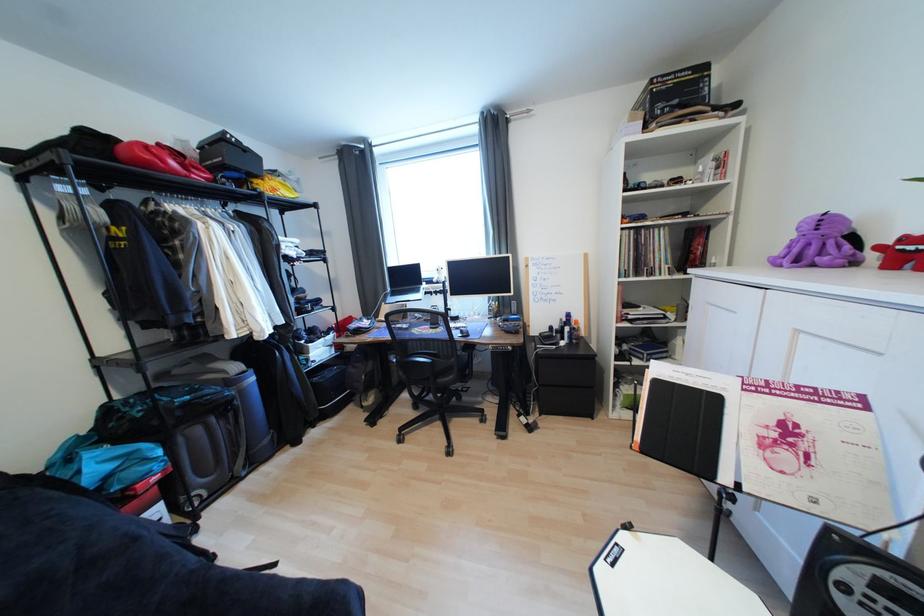
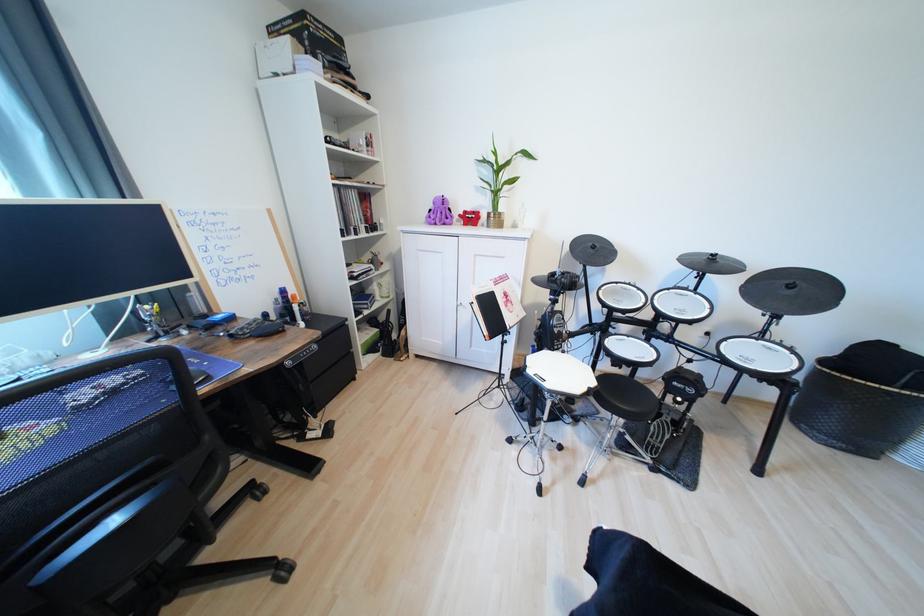
Where in the second image is the point corresponding to the point at 769,448 from the first image?

(513, 307)